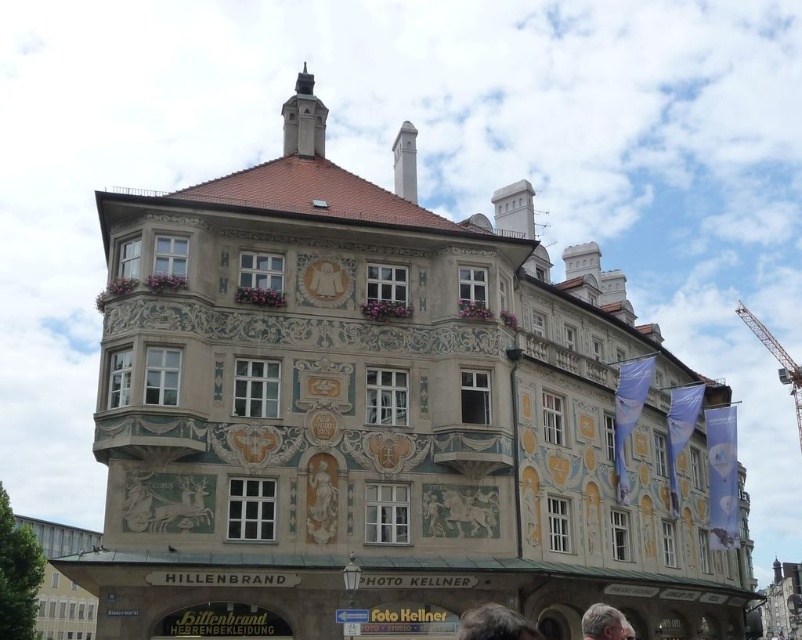
You are standing in front of the historic building and notice two items of interest. One is the white marble statue at center and the other is the metallic gray crane at upper right. Which of these two items is positioned to the left when viewed from your perspective?

The white marble statue at center is positioned to the left of the metallic gray crane at upper right, so the white marble statue at center is the one on the left side.

You are standing in front of the historic building and want to take a photo that includes both the point at coordinates [752,317] and the point at coordinates [600,630]. Which point should you focus on first to ensure both are in focus?

You should focus on point [600,630] first because it is closer to you than point [752,317], which is further away. By focusing on the closer point, the further point will also be in focus due to depth of field.